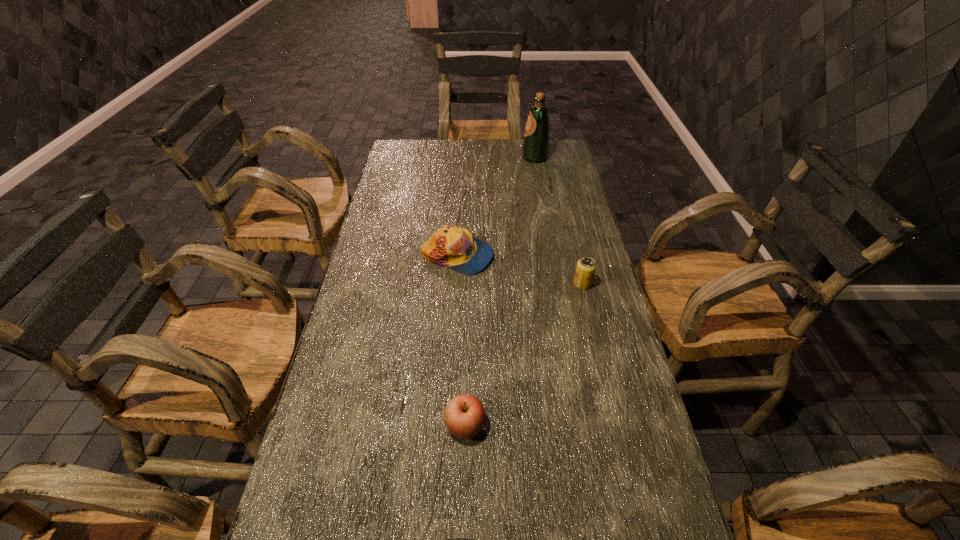
Identify the location of free space between the second nearest object and the tallest object. (500, 292).

This screenshot has height=540, width=960. I want to click on vacant space in between the second farthest object and the apple, so click(462, 341).

Where is `unoccupied position between the beer can and the cap`? The width and height of the screenshot is (960, 540). unoccupied position between the beer can and the cap is located at coordinates (520, 270).

Locate an element on the screen. unoccupied area between the fourth nearest object and the third farthest object is located at coordinates (520, 270).

What are the coordinates of `vacant area that lies between the beer can and the tallest object` in the screenshot? It's located at (559, 221).

Where is `free space between the fourth nearest object and the tallest object`? free space between the fourth nearest object and the tallest object is located at coordinates (496, 207).

Where is `object identified as the fourth closest to the fourth farthest object`? object identified as the fourth closest to the fourth farthest object is located at coordinates (535, 149).

At what (x,y) coordinates should I click in order to perform the action: click on the second closest object to the beer can. Please return your answer as a coordinate pair (x, y). This screenshot has width=960, height=540. Looking at the image, I should click on (464, 415).

Locate an element on the screen. free spot that satisfies the following two spatial constraints: 1. on the front-facing side of the farthest object; 2. on the back side of the beer can is located at coordinates (557, 284).

You are a GUI agent. You are given a task and a screenshot of the screen. Output one action in this format:
    pyautogui.click(x=<x>, y=<y>)
    Task: Click on the blank space that satisfies the following two spatial constraints: 1. on the bill of the third farthest object; 2. on the right side of the cap
    
    Given the screenshot: What is the action you would take?
    pyautogui.click(x=456, y=284)